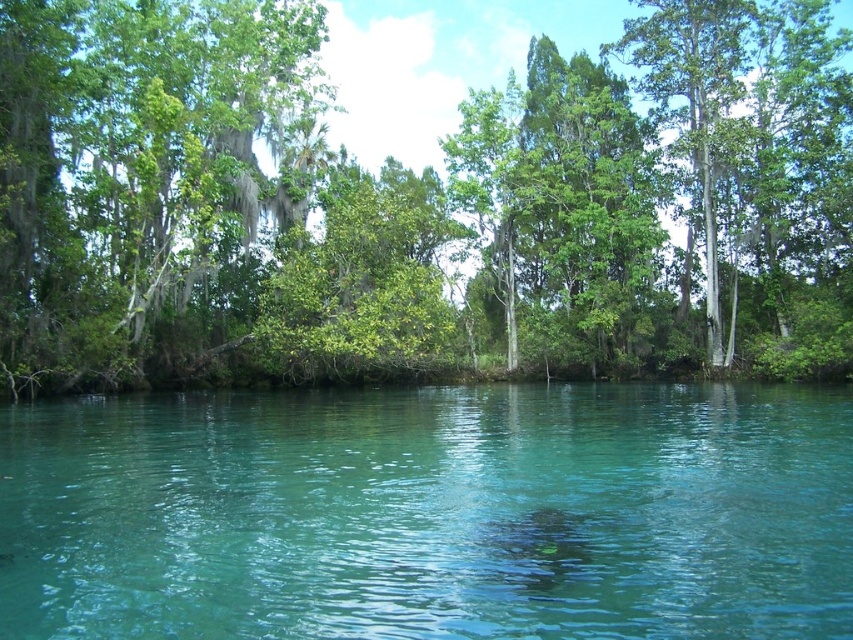
The height and width of the screenshot is (640, 853). What do you see at coordinates (430, 513) in the screenshot?
I see `clear water at center` at bounding box center [430, 513].

Looking at this image, does clear water at center lie in front of green leafy trees at left?

Yes, clear water at center is in front of green leafy trees at left.

Is point (293, 602) positioned after point (242, 10)?

No, it is not.

You are a GUI agent. You are given a task and a screenshot of the screen. Output one action in this format:
    pyautogui.click(x=<x>, y=<y>)
    Task: Click on the clear water at center
    Image resolution: width=853 pixels, height=640 pixels.
    Given the screenshot: What is the action you would take?
    pyautogui.click(x=430, y=513)

Between point (381, 294) and point (308, 513), which one is positioned in front?

Point (308, 513) is more forward.

Does green leafy tree at center appear on the left side of clear water at center?

Incorrect, green leafy tree at center is not on the left side of clear water at center.

Who is more distant from viewer, [102,326] or [97,529]?

The point [102,326] is more distant.

This screenshot has height=640, width=853. What are the coordinates of `green leafy tree at center` in the screenshot? It's located at (418, 202).

Is green leafy tree at center shorter than green leafy trees at left?

Incorrect, green leafy tree at center's height does not fall short of green leafy trees at left's.

Which of these two, green leafy tree at center or green leafy trees at left, stands taller?

With more height is green leafy tree at center.

In the scene shown: Who is more forward, (178, 17) or (148, 224)?

Point (148, 224) is in front.

Find the location of a particular element. The width and height of the screenshot is (853, 640). green leafy tree at center is located at coordinates (418, 202).